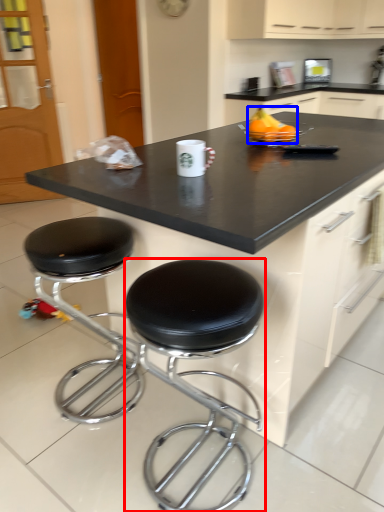
Question: Which of the following is the farthest to the observer, stool (highlighted by a red box) or fruit (highlighted by a blue box)?

Choices:
 (A) stool
 (B) fruit

Answer: (B)